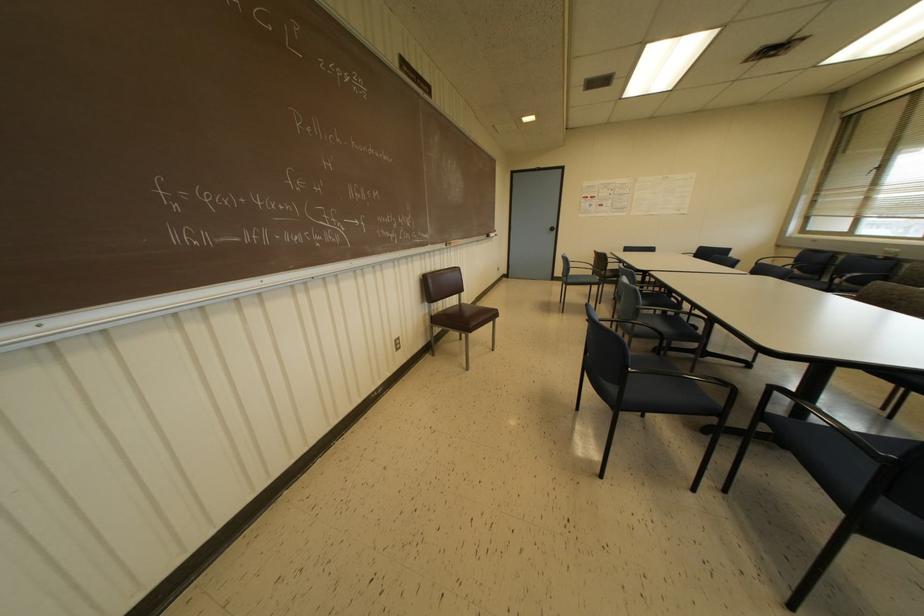
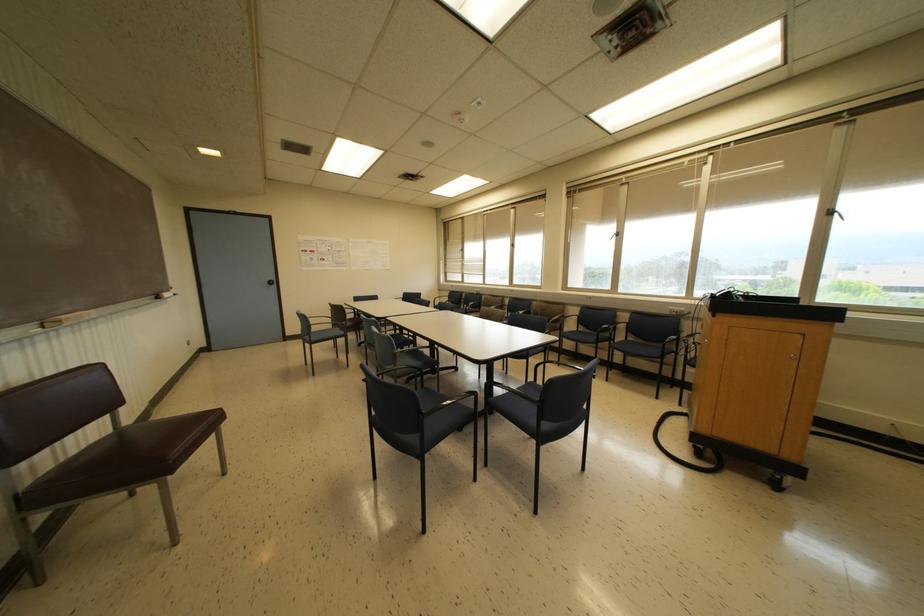
In the second image, find the point that corresponds to [886,487] in the first image.

(540, 415)